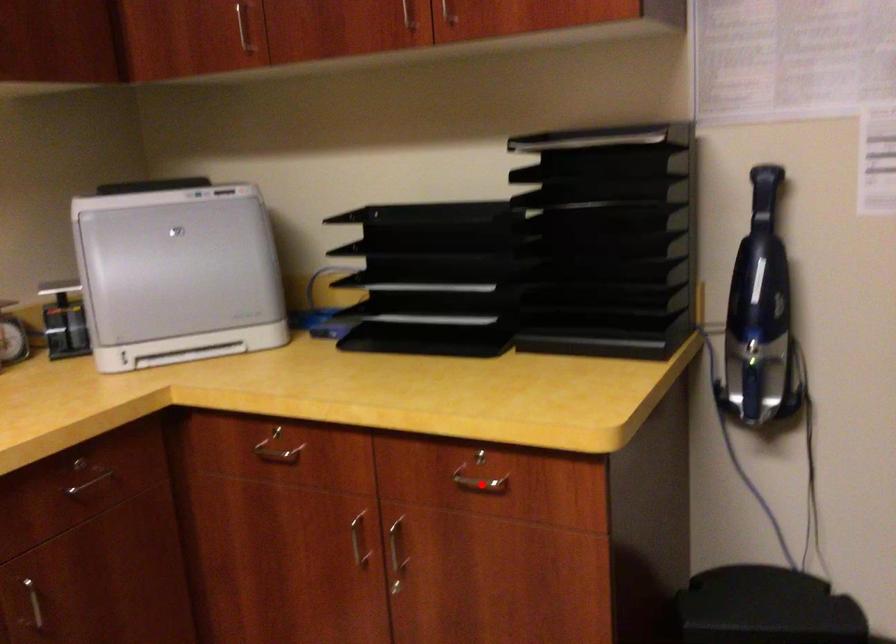
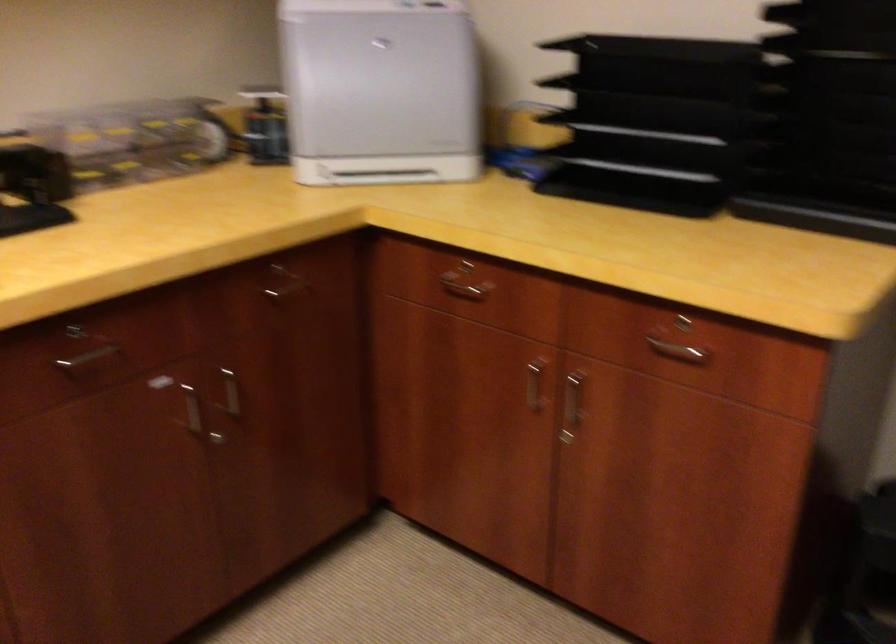
Find the pixel in the second image that matches the highlighted location in the first image.

(677, 351)